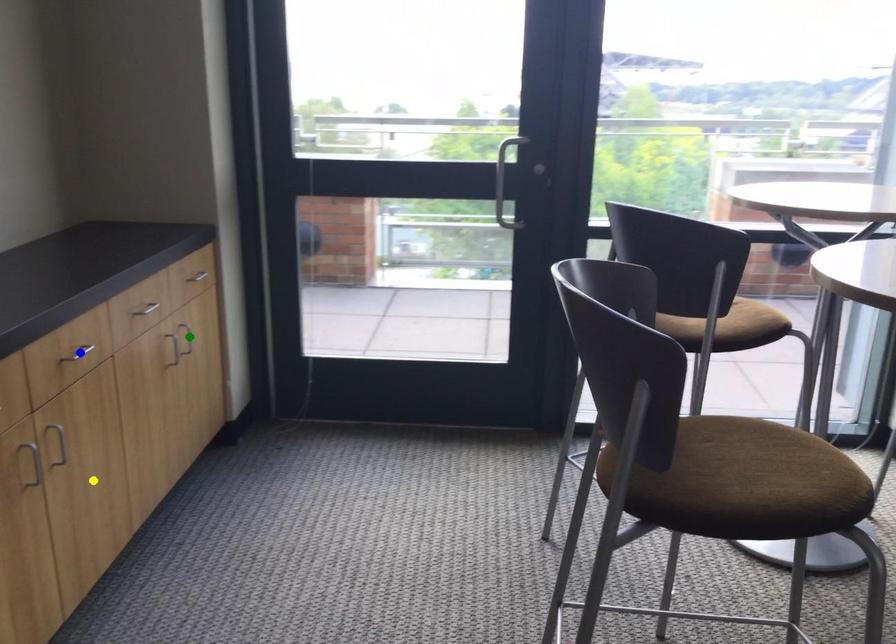
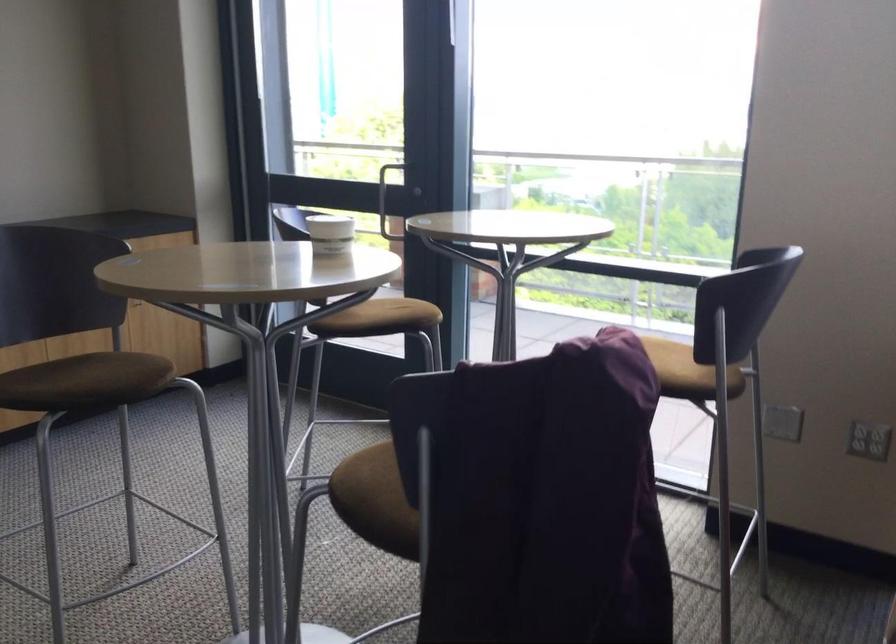
I am providing you with two images of the same scene from different viewpoints. Three points are marked in image1. Which point corresponds to a part or object that is occluded in image2?In image1, three points are marked. Which of them correspond to a part or object that is occluded in image2?Among the three points shown in image1, which one corresponds to a part or object that is no longer visible due to occlusion in image2?

blue point, green point cannot be seen in image2.